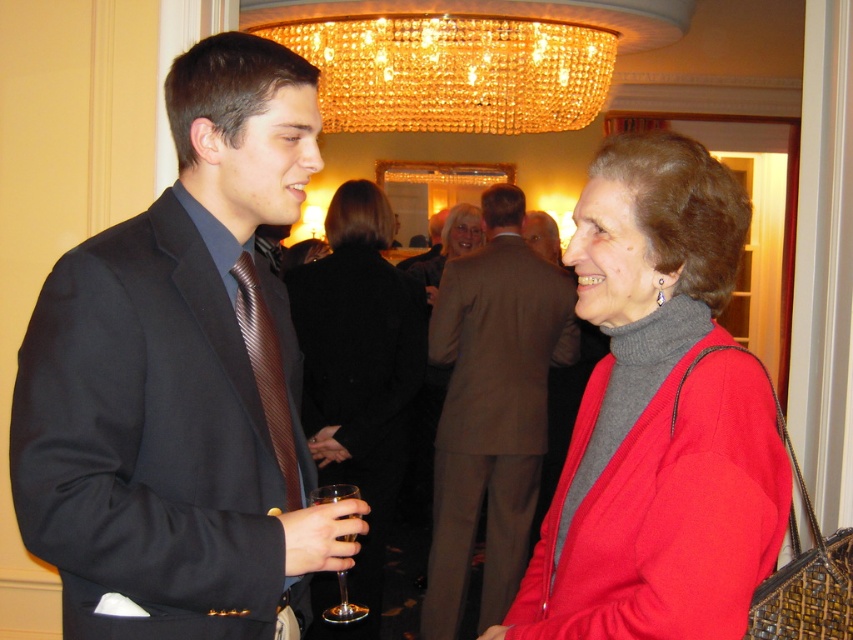
Is matte black sweater at center further to camera compared to matte gray sweater at center?

No, matte black sweater at center is in front of matte gray sweater at center.

Find the location of a particular element. matte black sweater at center is located at coordinates (358, 378).

I want to click on matte black sweater at center, so click(x=358, y=378).

Is point (712, 397) in front of point (328, 490)?

Yes, it is.

Between matte red sweater at center and clear glass wine glass at lower left, which one is positioned lower?

Positioned lower is clear glass wine glass at lower left.

At what (x,y) coordinates should I click in order to perform the action: click on matte red sweater at center. Please return your answer as a coordinate pair (x, y). This screenshot has height=640, width=853. Looking at the image, I should click on (657, 417).

Does point (332, 371) come closer to viewer compared to point (329, 486)?

No.

Can you confirm if matte black sweater at center is bigger than clear glass wine glass at lower left?

Correct, matte black sweater at center is larger in size than clear glass wine glass at lower left.

Find the location of a particular element. matte black sweater at center is located at coordinates pos(358,378).